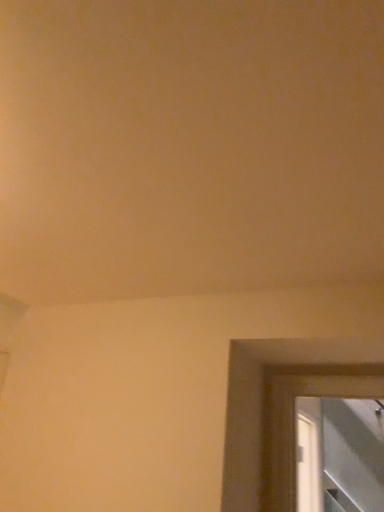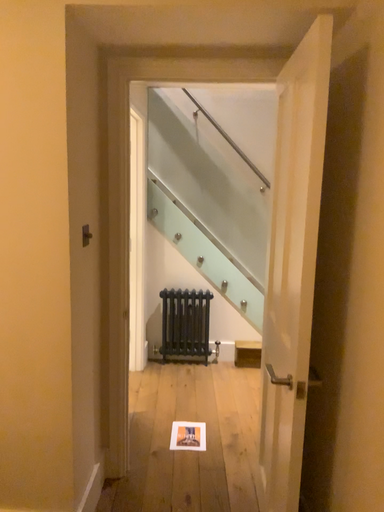
Question: How did the camera likely rotate when shooting the video?

Choices:
 (A) rotated downward
 (B) rotated upward

Answer: (A)